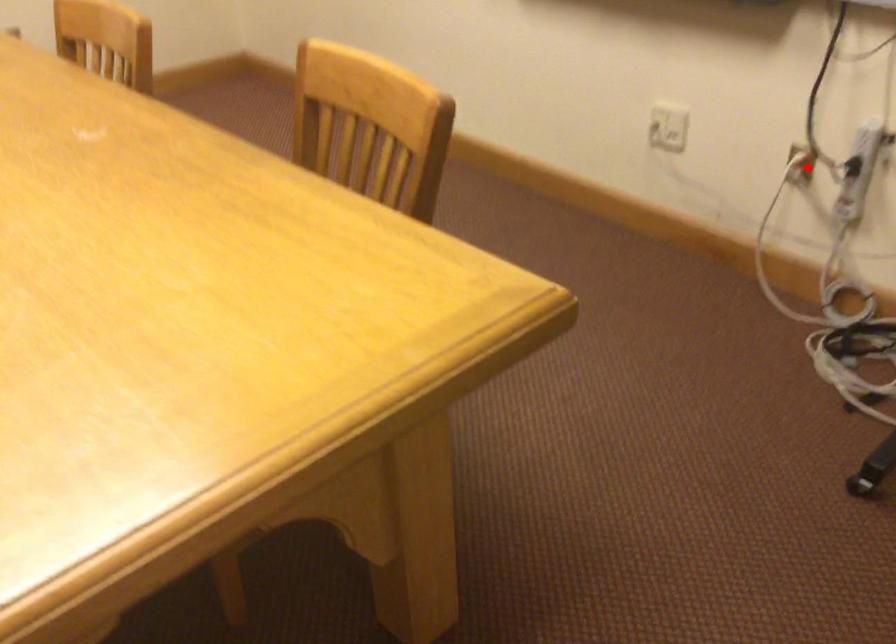
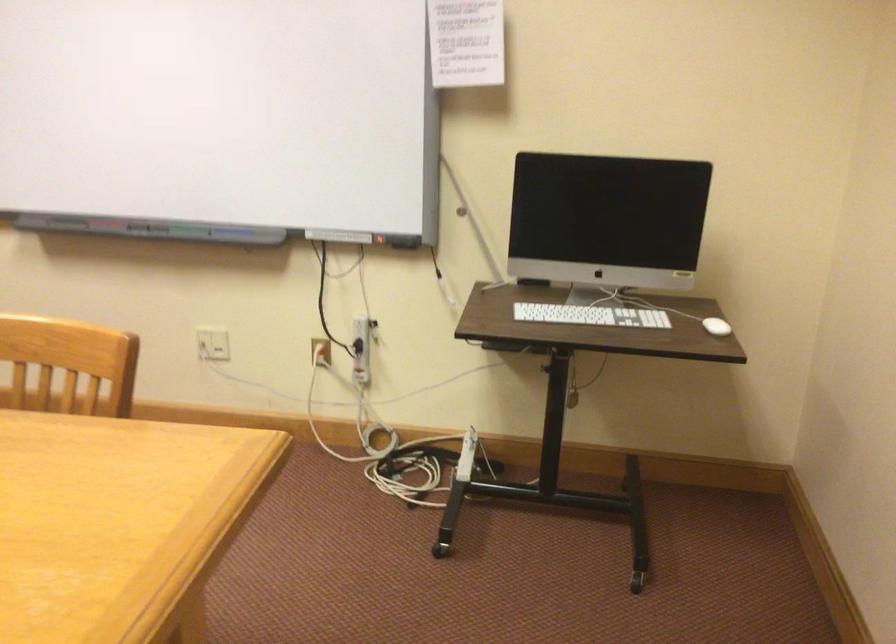
Question: I am providing you with two images of the same scene from different viewpoints. A red point is shown in image1. For the corresponding object point in image2, is it positioned nearer or farther from the camera?

Choices:
 (A) Nearer
 (B) Farther

Answer: (B)